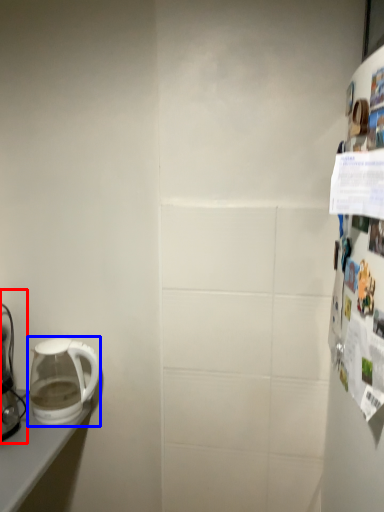
Question: Which point is closer to the camera, coffee maker (highlighted by a red box) or kettle (highlighted by a blue box)?

Choices:
 (A) coffee maker
 (B) kettle

Answer: (A)